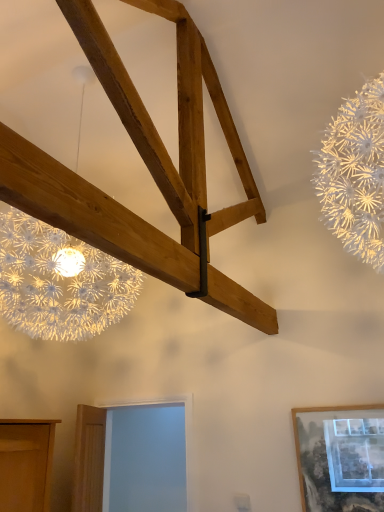
Question: Is matte wooden picture frame at lower right taller or shorter than blue glass window at lower center?

Choices:
 (A) tall
 (B) short

Answer: (B)

Question: Considering the positions of matte wooden picture frame at lower right and blue glass window at lower center in the image, is matte wooden picture frame at lower right wider or thinner than blue glass window at lower center?

Choices:
 (A) wide
 (B) thin

Answer: (B)

Question: Based on their sizes in the image, would you say matte wooden picture frame at lower right is bigger or smaller than blue glass window at lower center?

Choices:
 (A) big
 (B) small

Answer: (B)

Question: From a real-world perspective, is blue glass window at lower center positioned above or below matte wooden picture frame at lower right?

Choices:
 (A) below
 (B) above

Answer: (B)

Question: Is blue glass window at lower center taller or shorter than matte wooden picture frame at lower right?

Choices:
 (A) short
 (B) tall

Answer: (B)

Question: Considering their positions, is blue glass window at lower center located in front of or behind matte wooden picture frame at lower right?

Choices:
 (A) behind
 (B) front

Answer: (A)

Question: Is blue glass window at lower center wider or thinner than matte wooden picture frame at lower right?

Choices:
 (A) wide
 (B) thin

Answer: (A)